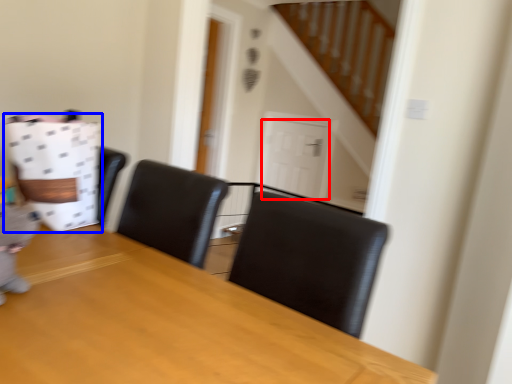
Question: Which of the following is the closest to the observer, door (highlighted by a red box) or paper bag (highlighted by a blue box)?

Choices:
 (A) door
 (B) paper bag

Answer: (B)